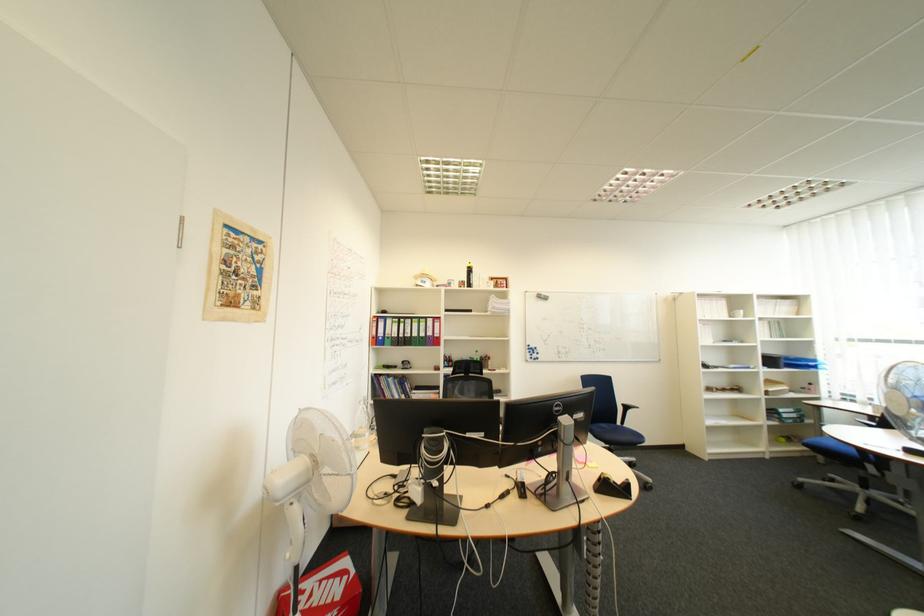
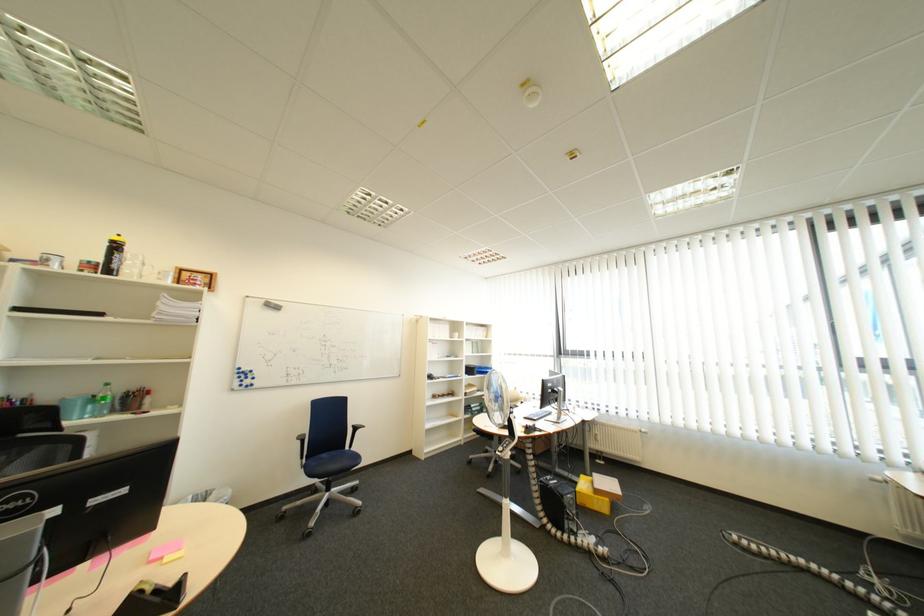
The point at (483, 283) is marked in the first image. Where is the corresponding point in the second image?

(128, 267)